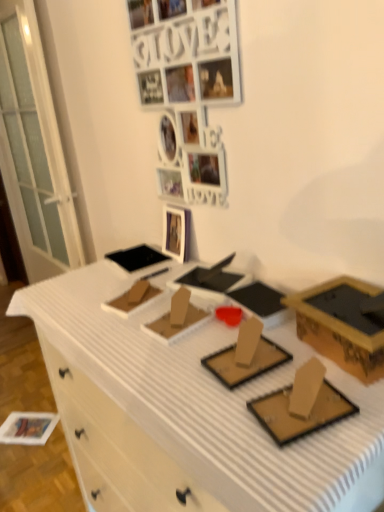
This screenshot has width=384, height=512. Identify the location of vacant region to the left of white glossy picture frame at upper center. (117, 272).